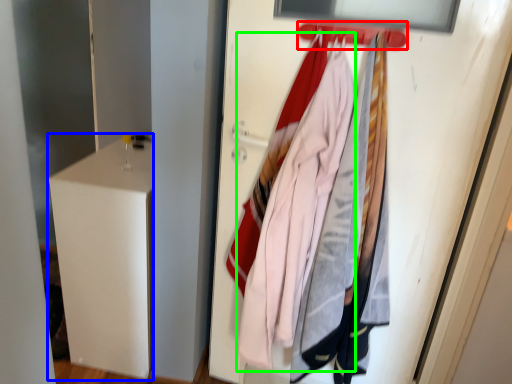
Question: Based on their relative distances, which object is farther from hanger (highlighted by a red box)? Choose from file cabinet (highlighted by a blue box) and clothing (highlighted by a green box).

Choices:
 (A) file cabinet
 (B) clothing

Answer: (A)